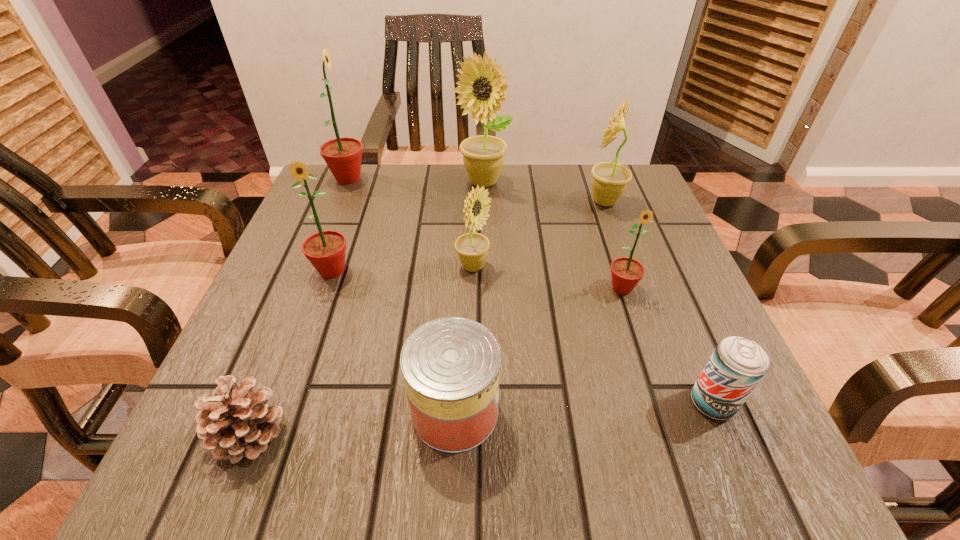
The height and width of the screenshot is (540, 960). I want to click on free space located on the face of the biggest yellow sunflower, so click(x=483, y=280).

You are a GUI agent. You are given a task and a screenshot of the screen. Output one action in this format:
    pyautogui.click(x=<x>, y=<y>)
    Task: Click on the free location located on the face of the second biggest yellow sunflower
    
    Given the screenshot: What is the action you would take?
    tap(467, 201)

Where is `vacant space located on the face of the second biggest yellow sunflower`? The width and height of the screenshot is (960, 540). vacant space located on the face of the second biggest yellow sunflower is located at coordinates (506, 201).

Identify the location of free region located 0.250m on the face of the second biggest yellow sunflower. (475, 201).

Find the location of a particular element. vacant area situated on the face of the second biggest green sunflower is located at coordinates (309, 336).

This screenshot has height=540, width=960. I want to click on free space located on the face of the smallest yellow sunflower, so click(568, 267).

At what (x,y) coordinates should I click in order to perform the action: click on free space located 0.310m on the face of the rightmost green sunflower. Please return your answer as a coordinate pair (x, y). Looking at the image, I should click on (683, 477).

Where is `vacant space positioned 0.090m on the left of the can`? The height and width of the screenshot is (540, 960). vacant space positioned 0.090m on the left of the can is located at coordinates (348, 411).

You are a GUI agent. You are given a task and a screenshot of the screen. Output one action in this format:
    pyautogui.click(x=<x>, y=<y>)
    Task: Click on the blank space located on the front of the beer can
    This screenshot has height=540, width=960.
    Given the screenshot: What is the action you would take?
    pyautogui.click(x=735, y=457)

Where is `free spot located 0.090m on the right of the brown pinecone`? The width and height of the screenshot is (960, 540). free spot located 0.090m on the right of the brown pinecone is located at coordinates (352, 433).